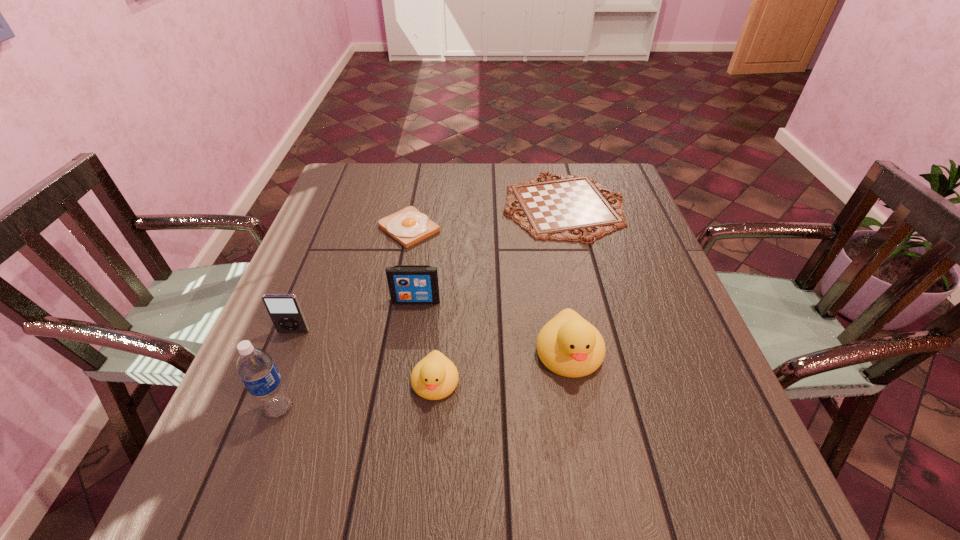
Identify the location of vacant area between the shorter duckling and the toast. This screenshot has width=960, height=540. pos(422,306).

Image resolution: width=960 pixels, height=540 pixels. Find the location of `object that is the fifth closest one to the shortest object`. object that is the fifth closest one to the shortest object is located at coordinates (284, 310).

Locate which object ranks in proximity to the right duckling. Please provide its 2D coordinates. Your answer should be formatted as a tuple, i.e. [(x, y)], where the tuple contains the x and y coordinates of a point satisfying the conditions above.

[(435, 377)]

At what (x,y) coordinates should I click in order to perform the action: click on free space that satisfies the following two spatial constraints: 1. on the back side of the shortest object; 2. on the left side of the tallest object. Please return your answer as a coordinate pair (x, y). The width and height of the screenshot is (960, 540). Looking at the image, I should click on (354, 206).